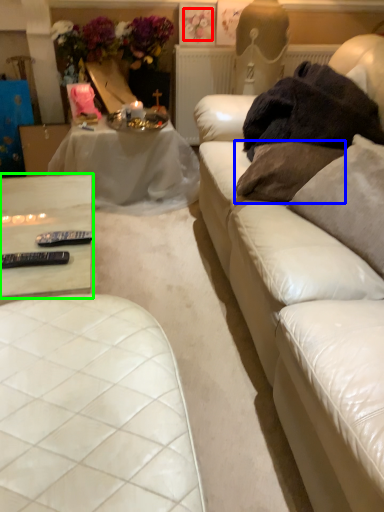
Question: Which object is the closest to the flower (highlighted by a red box)? Choose among these: pillow (highlighted by a blue box) or table (highlighted by a green box).

Choices:
 (A) pillow
 (B) table

Answer: (A)